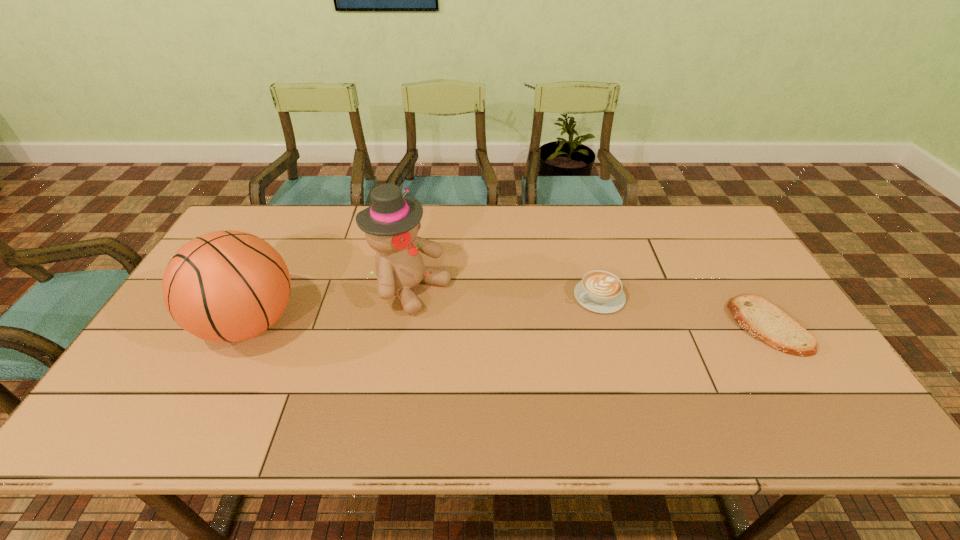
Locate an element on the screen. This screenshot has height=540, width=960. vacant point located between the shortest object and the basketball is located at coordinates (509, 325).

You are a GUI agent. You are given a task and a screenshot of the screen. Output one action in this format:
    pyautogui.click(x=<x>, y=<y>)
    Task: Click on the free space between the basketball and the third tallest object
    
    Given the screenshot: What is the action you would take?
    pyautogui.click(x=424, y=310)

Where is `unoccupied position between the third tallest object and the basketball`? The image size is (960, 540). unoccupied position between the third tallest object and the basketball is located at coordinates (424, 310).

The image size is (960, 540). In order to click on free space between the rag_doll and the third tallest object in this screenshot , I will do `click(505, 293)`.

Image resolution: width=960 pixels, height=540 pixels. What are the coordinates of `free space between the cappuccino and the shortest object` in the screenshot? It's located at (684, 312).

Identify the location of free area in between the basketball and the second object from left to right. The height and width of the screenshot is (540, 960). (330, 307).

Locate an element on the screen. The image size is (960, 540). vacant area that lies between the shortest object and the basketball is located at coordinates (509, 325).

What are the coordinates of `empty space that is in between the cappuccino and the pita bread` in the screenshot? It's located at (684, 312).

Locate which object is the third closest to the cappuccino. Please provide its 2D coordinates. Your answer should be formatted as a tuple, i.e. [(x, y)], where the tuple contains the x and y coordinates of a point satisfying the conditions above.

[(227, 286)]

Identify which object is located as the second nearest to the third object from left to right. Please provide its 2D coordinates. Your answer should be formatted as a tuple, i.e. [(x, y)], where the tuple contains the x and y coordinates of a point satisfying the conditions above.

[(391, 224)]